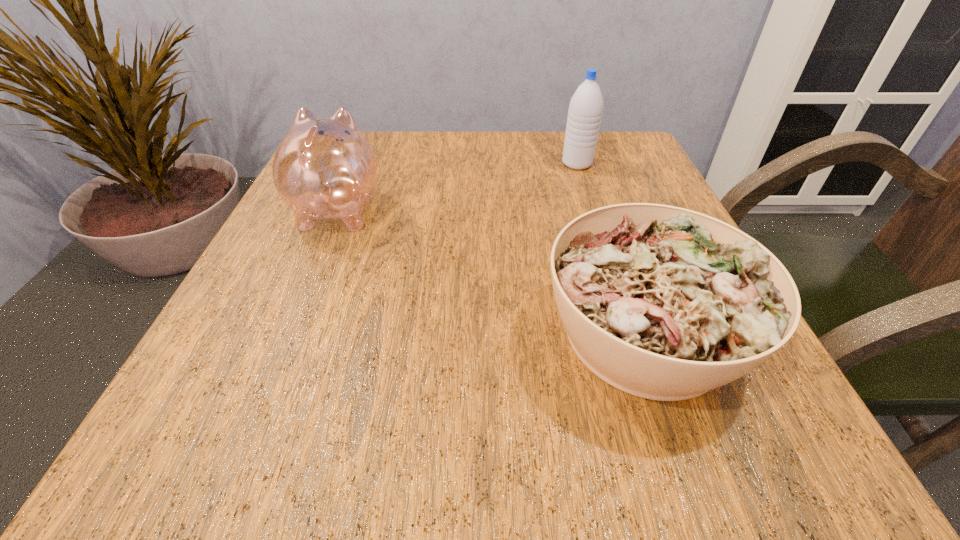
This screenshot has width=960, height=540. I want to click on free area in between the salad and the piggy bank, so click(x=492, y=271).

Locate which object is the closest to the piggy bank. Please provide its 2D coordinates. Your answer should be formatted as a tuple, i.e. [(x, y)], where the tuple contains the x and y coordinates of a point satisfying the conditions above.

[(664, 303)]

Locate which object is the closest to the nearest object. Please provide its 2D coordinates. Your answer should be formatted as a tuple, i.e. [(x, y)], where the tuple contains the x and y coordinates of a point satisfying the conditions above.

[(324, 168)]

This screenshot has width=960, height=540. I want to click on vacant space that satisfies the following two spatial constraints: 1. on the front facing side of the leftmost object; 2. on the left side of the water bottle, so click(x=356, y=164).

Find the location of a particular element. The height and width of the screenshot is (540, 960). free location that satisfies the following two spatial constraints: 1. on the front side of the farthest object; 2. on the right side of the salad is located at coordinates (632, 333).

At what (x,y) coordinates should I click in order to perform the action: click on free location that satisfies the following two spatial constraints: 1. on the front facing side of the second nearest object; 2. on the right side of the farthest object. Please return your answer as a coordinate pair (x, y). This screenshot has height=540, width=960. Looking at the image, I should click on (356, 164).

At what (x,y) coordinates should I click in order to perform the action: click on vacant space that satisfies the following two spatial constraints: 1. on the front facing side of the second farthest object; 2. on the right side of the water bottle. Please return your answer as a coordinate pair (x, y). This screenshot has height=540, width=960. Looking at the image, I should click on (356, 164).

You are a GUI agent. You are given a task and a screenshot of the screen. Output one action in this format:
    pyautogui.click(x=<x>, y=<y>)
    Task: Click on the free spot that satisfies the following two spatial constraints: 1. on the front facing side of the water bottle; 2. on the right side of the piggy bank
    The image size is (960, 540).
    Given the screenshot: What is the action you would take?
    pyautogui.click(x=356, y=164)